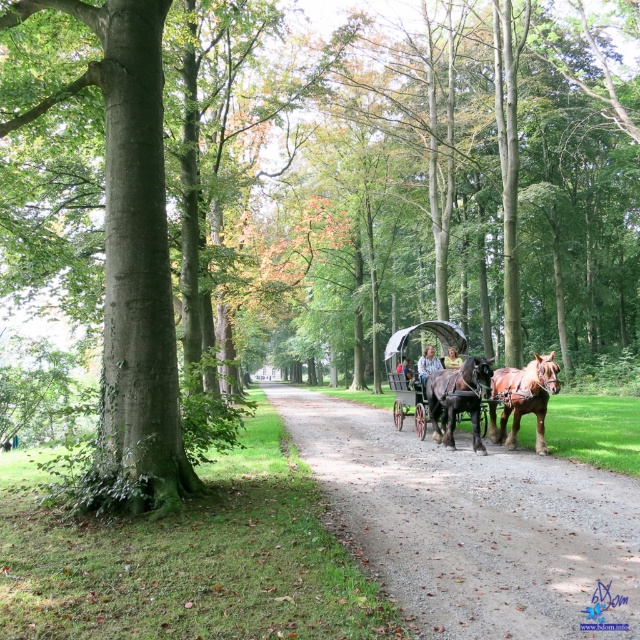
You are a photographer planning to take a photo of the scene. You want to ensure both the brown glossy horse at center and the shiny black carriage at center are clearly visible. Given their sizes, which object should you focus on first to ensure proper framing?

The brown glossy horse at center occupies less space than the shiny black carriage at center, so you should focus on the brown glossy horse at center first to ensure it is properly framed and in focus, as it may be smaller and require precise positioning.

You are standing at the camera position and want to take a photo of the shiny black carriage at center. The camera has a maximum focus range of 50 feet. Will the carriage be in focus?

The shiny black carriage at center and camera are 54.24 feet apart from each other. Since the distance exceeds the camera maximum focus range of 50 feet, the carriage will not be in focus.

You are a passenger in the horse drawn carriage. You look down and see the gravel path at center and the brown glossy horse at center. Which object is closer to you?

The gravel path at center is located below the brown glossy horse at center, so the gravel path at center is closer to you.